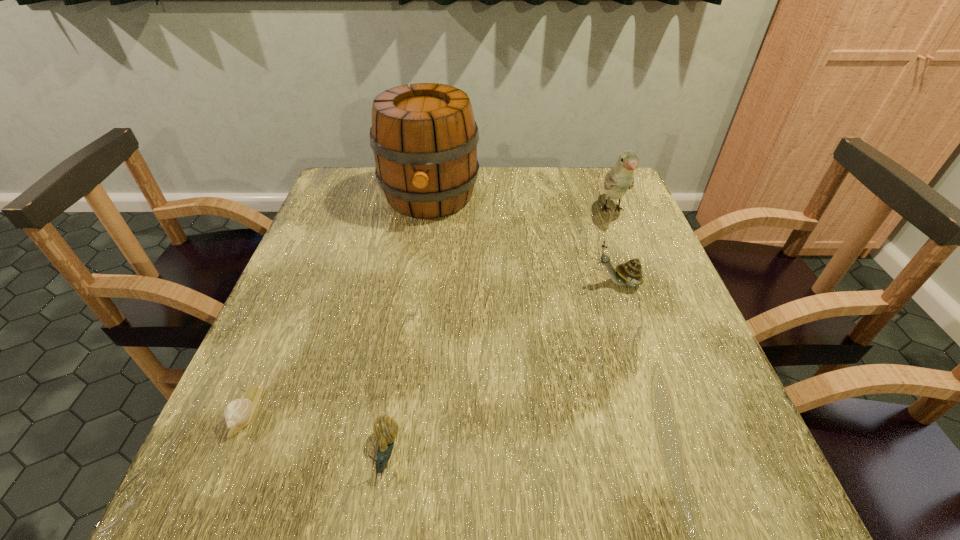
Identify the location of free space between the second escargot from right to left and the cider. This screenshot has width=960, height=540. (408, 325).

The image size is (960, 540). In order to click on unoccupied area between the leftmost escargot and the fourth shortest object in this screenshot , I will do `click(430, 310)`.

The height and width of the screenshot is (540, 960). Find the location of `free point between the cider and the bird`. free point between the cider and the bird is located at coordinates (521, 204).

The image size is (960, 540). In order to click on vacant space that is in between the second tallest object and the tallest escargot in this screenshot , I will do `click(615, 247)`.

The height and width of the screenshot is (540, 960). What are the coordinates of `empty location between the bird and the cider` in the screenshot? It's located at (521, 204).

Locate an element on the screen. The height and width of the screenshot is (540, 960). vacant area that lies between the leftmost escargot and the tallest escargot is located at coordinates (433, 347).

Identify the location of unoccupied area between the second escargot from left to right and the tallest object. The image size is (960, 540). point(408,325).

Where is `unoccupied position between the rightmost escargot and the cider`? unoccupied position between the rightmost escargot and the cider is located at coordinates (524, 240).

Select which object is the second closest to the shortest escargot. Please provide its 2D coordinates. Your answer should be formatted as a tuple, i.e. [(x, y)], where the tuple contains the x and y coordinates of a point satisfying the conditions above.

[(424, 138)]

Where is `object that ranks as the fourth closest to the shortest escargot`? The width and height of the screenshot is (960, 540). object that ranks as the fourth closest to the shortest escargot is located at coordinates (620, 178).